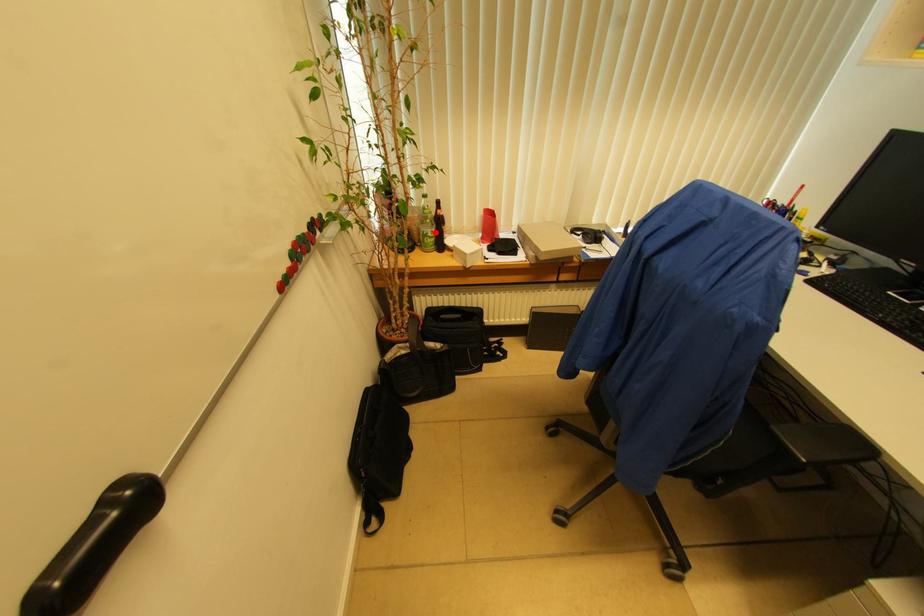
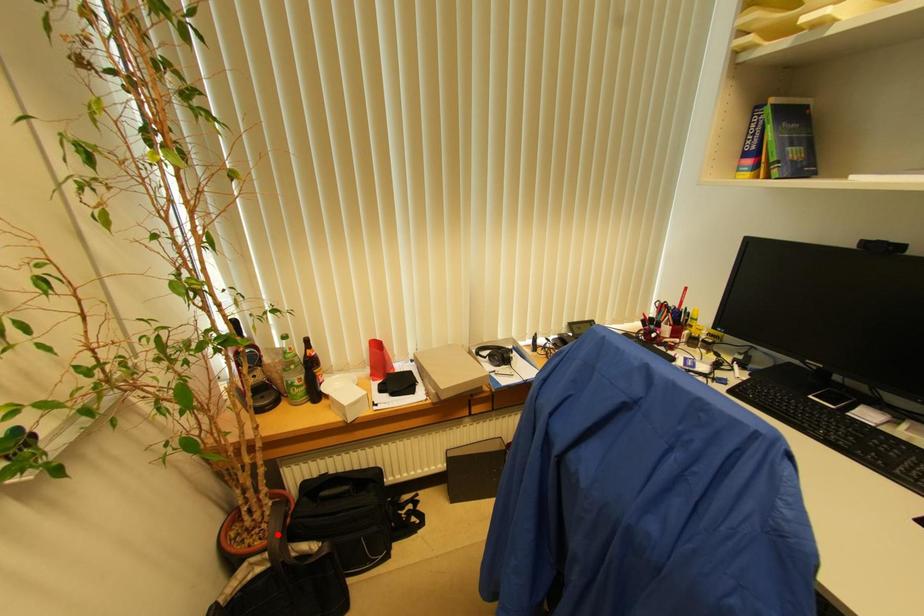
I am providing you with two images of the same scene from different viewpoints. A red point is marked on the first image and another point is marked on the second image. Does the point marked in image1 correspond to the same location as the one in image2?

No